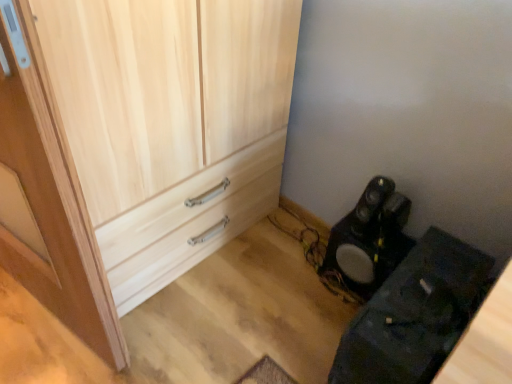
Question: From a real-world perspective, is wooden door at left above or below natural wood cupboard at center?

Choices:
 (A) above
 (B) below

Answer: (A)

Question: Is wooden door at left taller or shorter than natural wood cupboard at center?

Choices:
 (A) tall
 (B) short

Answer: (A)

Question: Based on their relative distances, which object is nearer to the black matte speaker at lower right?

Choices:
 (A) natural wood cupboard at center
 (B) wooden door at left
 (C) black matte speaker at lower right

Answer: (C)

Question: Which of these objects is positioned closest to the black matte speaker at lower right?

Choices:
 (A) natural wood cupboard at center
 (B) black matte speaker at lower right
 (C) wooden door at left

Answer: (B)